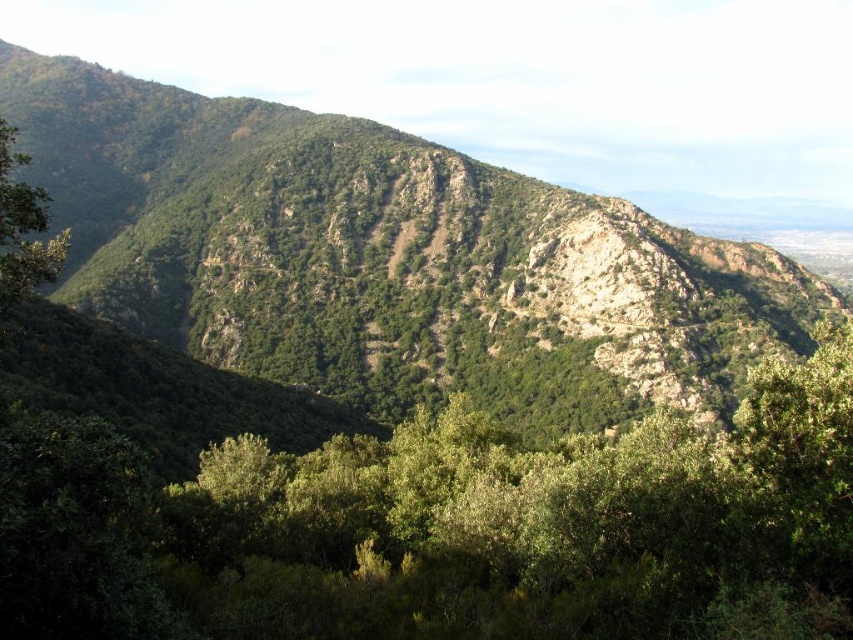
Question: Which of the following is the farthest from the observer?

Choices:
 (A) green leafy tree at left
 (B) green rocky mountain at center
 (C) green leafy tree at center

Answer: (B)

Question: Does green rocky mountain at center lie behind green leafy tree at left?

Choices:
 (A) yes
 (B) no

Answer: (A)

Question: Which object is the closest to the green leafy tree at center?

Choices:
 (A) green leafy tree at left
 (B) green rocky mountain at center

Answer: (A)

Question: Which of the following is the closest to the observer?

Choices:
 (A) green rocky mountain at center
 (B) green leafy tree at left

Answer: (B)

Question: Does green leafy tree at center appear over green leafy tree at left?

Choices:
 (A) no
 (B) yes

Answer: (A)

Question: Can you confirm if green leafy tree at center is positioned to the right of green rocky mountain at center?

Choices:
 (A) no
 (B) yes

Answer: (B)